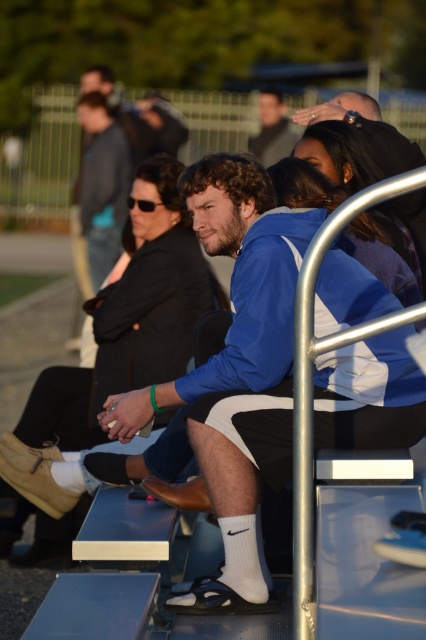
Question: Does blue fleece jacket at center appear on the right side of matte black jacket at center?

Choices:
 (A) no
 (B) yes

Answer: (B)

Question: Which object is farther from the camera taking this photo?

Choices:
 (A) matte black jacket at center
 (B) blue fleece jacket at center

Answer: (A)

Question: Can you confirm if blue fleece jacket at center is smaller than matte black jacket at center?

Choices:
 (A) yes
 (B) no

Answer: (A)

Question: Which object appears farthest from the camera in this image?

Choices:
 (A) blue fleece jacket at center
 (B) matte black jacket at center

Answer: (B)

Question: Which point is farther to the camera?

Choices:
 (A) (267, 125)
 (B) (296, 116)

Answer: (A)

Question: Is blue fleece jacket at center behind matte black jacket at center?

Choices:
 (A) yes
 (B) no

Answer: (B)